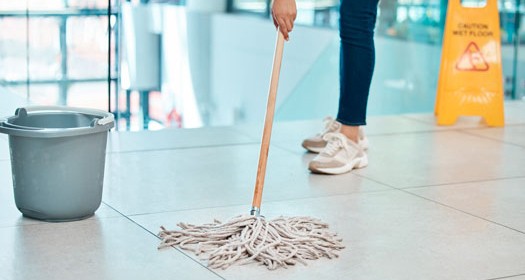
The image size is (525, 280). In order to click on caution wet floor stand in this screenshot , I will do `click(455, 89)`.